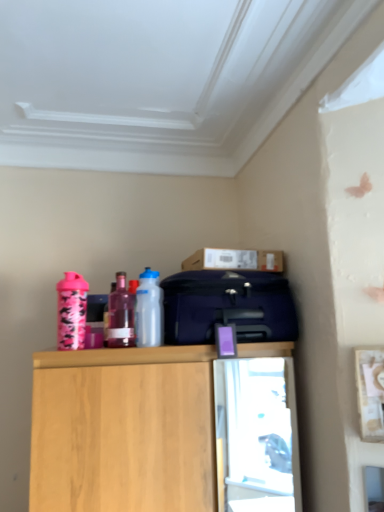
This screenshot has width=384, height=512. What do you see at coordinates (123, 430) in the screenshot? I see `wooden cabinet at upper center` at bounding box center [123, 430].

Describe the element at coordinates (120, 315) in the screenshot. I see `translucent purple bottle at center, placed as the 2th bottle when sorted from left to right` at that location.

Where is `translucent purple bottle at center, placed as the 2th bottle when sorted from left to right`? The height and width of the screenshot is (512, 384). translucent purple bottle at center, placed as the 2th bottle when sorted from left to right is located at coordinates (120, 315).

The height and width of the screenshot is (512, 384). What do you see at coordinates (71, 311) in the screenshot? I see `pink matte shaker at left, arranged as the 3th bottle when viewed from the right` at bounding box center [71, 311].

Where is `pink matte shaker at left, positioned as the first bottle in left-to-right order`? Image resolution: width=384 pixels, height=512 pixels. pink matte shaker at left, positioned as the first bottle in left-to-right order is located at coordinates (71, 311).

The width and height of the screenshot is (384, 512). I want to click on cardboard box at upper center, so click(x=234, y=260).

Identify the location of wooden cabinet at upper center. (123, 430).

Is transparent plastic bottle at center, which is counted as the first bottle, starting from the right, closer to camera compared to translucent purple bottle at center, placed as the 2th bottle when sorted from left to right?

No, transparent plastic bottle at center, which is counted as the first bottle, starting from the right, is further to the viewer.

From a real-world perspective, between transparent plastic bottle at center, positioned as the 3th bottle in left-to-right order, and translucent purple bottle at center, marked as the second bottle in a right-to-left arrangement, who is vertically lower?

translucent purple bottle at center, marked as the second bottle in a right-to-left arrangement.

Based on the photo, between transparent plastic bottle at center, positioned as the 3th bottle in left-to-right order, and translucent purple bottle at center, placed as the 2th bottle when sorted from left to right, which one has smaller size?

With smaller size is translucent purple bottle at center, placed as the 2th bottle when sorted from left to right.

From the image's perspective, does transparent plastic bottle at center, which is counted as the first bottle, starting from the right, appear lower than translucent purple bottle at center, placed as the 2th bottle when sorted from left to right?

No.

From the image's perspective, is transparent plastic bottle at center, which is counted as the first bottle, starting from the right, above or below pink matte shaker at left, arranged as the 3th bottle when viewed from the right?

transparent plastic bottle at center, which is counted as the first bottle, starting from the right, is above pink matte shaker at left, arranged as the 3th bottle when viewed from the right.

Can you confirm if transparent plastic bottle at center, which is counted as the first bottle, starting from the right, is wider than pink matte shaker at left, positioned as the first bottle in left-to-right order?

Correct, the width of transparent plastic bottle at center, which is counted as the first bottle, starting from the right, exceeds that of pink matte shaker at left, positioned as the first bottle in left-to-right order.

In the scene shown: Considering the sizes of objects transparent plastic bottle at center, positioned as the 3th bottle in left-to-right order, and pink matte shaker at left, positioned as the first bottle in left-to-right order, in the image provided, who is shorter, transparent plastic bottle at center, positioned as the 3th bottle in left-to-right order, or pink matte shaker at left, positioned as the first bottle in left-to-right order,?

Standing shorter between the two is pink matte shaker at left, positioned as the first bottle in left-to-right order.

From a real-world perspective, is transparent plastic bottle at center, positioned as the 3th bottle in left-to-right order, positioned above or below pink matte shaker at left, arranged as the 3th bottle when viewed from the right?

transparent plastic bottle at center, positioned as the 3th bottle in left-to-right order, is situated higher than pink matte shaker at left, arranged as the 3th bottle when viewed from the right, in the real world.

Visually, is pink matte shaker at left, arranged as the 3th bottle when viewed from the right, positioned to the left or to the right of translucent purple bottle at center, placed as the 2th bottle when sorted from left to right?

pink matte shaker at left, arranged as the 3th bottle when viewed from the right, is positioned on translucent purple bottle at center, placed as the 2th bottle when sorted from left to right,'s left side.

From a real-world perspective, is pink matte shaker at left, positioned as the first bottle in left-to-right order, under translucent purple bottle at center, marked as the second bottle in a right-to-left arrangement?

Yes, from a real-world perspective, pink matte shaker at left, positioned as the first bottle in left-to-right order, is beneath translucent purple bottle at center, marked as the second bottle in a right-to-left arrangement.

Is pink matte shaker at left, positioned as the first bottle in left-to-right order, oriented towards translucent purple bottle at center, placed as the 2th bottle when sorted from left to right?

No, pink matte shaker at left, positioned as the first bottle in left-to-right order, is not aimed at translucent purple bottle at center, placed as the 2th bottle when sorted from left to right.

From the image's perspective, which is below, pink matte shaker at left, arranged as the 3th bottle when viewed from the right, or translucent purple bottle at center, marked as the second bottle in a right-to-left arrangement?

pink matte shaker at left, arranged as the 3th bottle when viewed from the right, is shown below in the image.

Is wooden cabinet at upper center aimed at translucent purple bottle at center, placed as the 2th bottle when sorted from left to right?

No, wooden cabinet at upper center is not turned towards translucent purple bottle at center, placed as the 2th bottle when sorted from left to right.

From the image's perspective, would you say wooden cabinet at upper center is shown under translucent purple bottle at center, marked as the second bottle in a right-to-left arrangement?

Yes.

Which is farther, (129, 493) or (126, 334)?

The point (126, 334) is farther from the camera.

Does wooden cabinet at upper center have a smaller size compared to translucent purple bottle at center, marked as the second bottle in a right-to-left arrangement?

No.

From a real-world perspective, is transparent plastic bottle at center, positioned as the 3th bottle in left-to-right order, above or below matte blue suitcase at center?

transparent plastic bottle at center, positioned as the 3th bottle in left-to-right order, is situated higher than matte blue suitcase at center in the real world.

Who is smaller, transparent plastic bottle at center, which is counted as the first bottle, starting from the right, or matte blue suitcase at center?

With smaller size is transparent plastic bottle at center, which is counted as the first bottle, starting from the right.

From the image's perspective, is transparent plastic bottle at center, which is counted as the first bottle, starting from the right, positioned above or below matte blue suitcase at center?

From the image's perspective, transparent plastic bottle at center, which is counted as the first bottle, starting from the right, appears above matte blue suitcase at center.

Is transparent plastic bottle at center, which is counted as the first bottle, starting from the right, far from matte blue suitcase at center?

No, there isn't a large distance between transparent plastic bottle at center, which is counted as the first bottle, starting from the right, and matte blue suitcase at center.

Would you say matte blue suitcase at center is a long distance from transparent plastic bottle at center, which is counted as the first bottle, starting from the right?

No, matte blue suitcase at center is not far away from transparent plastic bottle at center, which is counted as the first bottle, starting from the right.

Could you tell me if matte blue suitcase at center is facing transparent plastic bottle at center, positioned as the 3th bottle in left-to-right order?

No, matte blue suitcase at center is not turned towards transparent plastic bottle at center, positioned as the 3th bottle in left-to-right order.

Based on the photo, from the image's perspective, which is below, matte blue suitcase at center or transparent plastic bottle at center, positioned as the 3th bottle in left-to-right order?

From the image's view, matte blue suitcase at center is below.

Which of these two, matte blue suitcase at center or transparent plastic bottle at center, positioned as the 3th bottle in left-to-right order, is smaller?

transparent plastic bottle at center, positioned as the 3th bottle in left-to-right order, is smaller.

From the picture: Which point is more distant from viewer, (179, 395) or (195, 337)?

The point (195, 337) is farther from the camera.

From the image's perspective, relative to matte blue suitcase at center, is wooden cabinet at upper center above or below?

Based on their image positions, wooden cabinet at upper center is located beneath matte blue suitcase at center.

Considering the sizes of objects wooden cabinet at upper center and matte blue suitcase at center in the image provided, who is wider, wooden cabinet at upper center or matte blue suitcase at center?

wooden cabinet at upper center is wider.

Consider the image. Is wooden cabinet at upper center taller or shorter than matte blue suitcase at center?

In the image, wooden cabinet at upper center appears to be taller than matte blue suitcase at center.

Locate an element on the screen. This screenshot has width=384, height=512. bottle on the right of translucent purple bottle at center, marked as the second bottle in a right-to-left arrangement is located at coordinates (149, 310).

Find the location of `bottle that is the 2nd one below the transparent plastic bottle at center, which is counted as the first bottle, starting from the right (from a real-world perspective)`. bottle that is the 2nd one below the transparent plastic bottle at center, which is counted as the first bottle, starting from the right (from a real-world perspective) is located at coordinates (71, 311).

Estimate the real-world distances between objects in this image. Which object is further from pink matte shaker at left, positioned as the first bottle in left-to-right order, wooden cabinet at upper center or cardboard box at upper center?

cardboard box at upper center is positioned further to the anchor pink matte shaker at left, positioned as the first bottle in left-to-right order.

When comparing their distances from wooden cabinet at upper center, does transparent plastic bottle at center, positioned as the 3th bottle in left-to-right order, or cardboard box at upper center seem closer?

Among the two, transparent plastic bottle at center, positioned as the 3th bottle in left-to-right order, is located nearer to wooden cabinet at upper center.

Based on their spatial positions, is cardboard box at upper center or wooden cabinet at upper center closer to matte blue suitcase at center?

Based on the image, cardboard box at upper center appears to be nearer to matte blue suitcase at center.

Estimate the real-world distances between objects in this image. Which object is closer to matte blue suitcase at center, pink matte shaker at left, arranged as the 3th bottle when viewed from the right, or wooden cabinet at upper center?

wooden cabinet at upper center is positioned closer to the anchor matte blue suitcase at center.

When comparing their distances from wooden cabinet at upper center, does cardboard box at upper center or matte blue suitcase at center seem closer?

The object closer to wooden cabinet at upper center is matte blue suitcase at center.

Which object lies nearer to the anchor point wooden cabinet at upper center, matte blue suitcase at center or cardboard box at upper center?

Among the two, matte blue suitcase at center is located nearer to wooden cabinet at upper center.

In the scene shown: Estimate the real-world distances between objects in this image. Which object is further from cardboard box at upper center, pink matte shaker at left, positioned as the first bottle in left-to-right order, or transparent plastic bottle at center, positioned as the 3th bottle in left-to-right order?

pink matte shaker at left, positioned as the first bottle in left-to-right order.

Looking at the image, which one is located closer to translucent purple bottle at center, placed as the 2th bottle when sorted from left to right, matte blue suitcase at center or wooden cabinet at upper center?

matte blue suitcase at center lies closer to translucent purple bottle at center, placed as the 2th bottle when sorted from left to right, than the other object.

The height and width of the screenshot is (512, 384). Identify the location of bottle between translucent purple bottle at center, placed as the 2th bottle when sorted from left to right, and wooden cabinet at upper center in the up-down direction. (71, 311).

This screenshot has height=512, width=384. Identify the location of luggage between transparent plastic bottle at center, which is counted as the first bottle, starting from the right, and cardboard box at upper center from left to right. (228, 306).

Locate an element on the screen. This screenshot has height=512, width=384. luggage between transparent plastic bottle at center, which is counted as the first bottle, starting from the right, and wooden cabinet at upper center from top to bottom is located at coordinates (228, 306).

Identify the location of bottle between translucent purple bottle at center, marked as the second bottle in a right-to-left arrangement, and matte blue suitcase at center, in the horizontal direction. (149, 310).